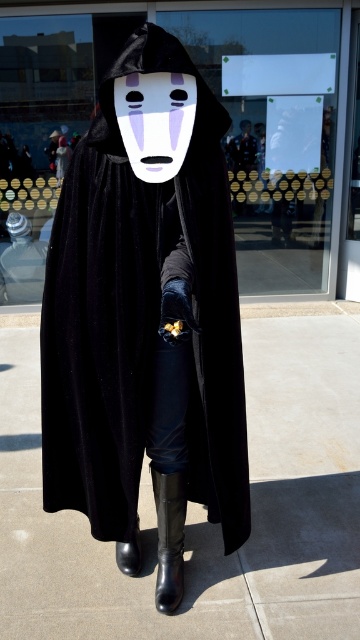
Question: Among these points, which one is farthest from the camera?

Choices:
 (A) (159, 579)
 (B) (158, 163)
 (C) (196, 150)

Answer: (A)

Question: Can you confirm if black velvet cloak at center is smaller than black rubber boot at lower center?

Choices:
 (A) yes
 (B) no

Answer: (B)

Question: Which point is closer to the camera?

Choices:
 (A) (84, 173)
 (B) (173, 560)

Answer: (A)

Question: Is black velvet cloak at center to the left of white matte mask at center from the viewer's perspective?

Choices:
 (A) no
 (B) yes

Answer: (B)

Question: Can you confirm if black velvet cloak at center is thinner than black rubber boot at lower center?

Choices:
 (A) no
 (B) yes

Answer: (A)

Question: Which object is the closest to the black rubber boot at lower center?

Choices:
 (A) white matte mask at center
 (B) black velvet cloak at center

Answer: (B)